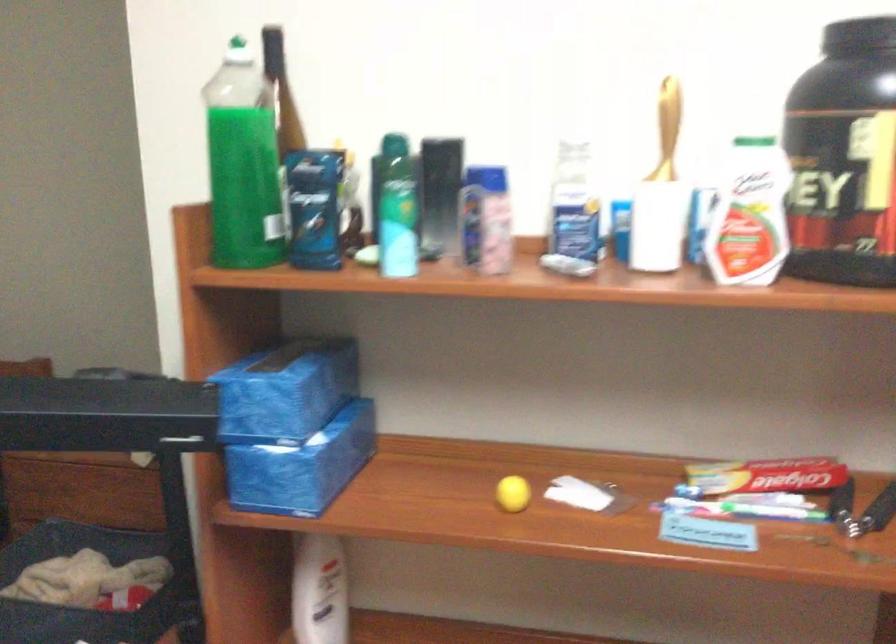
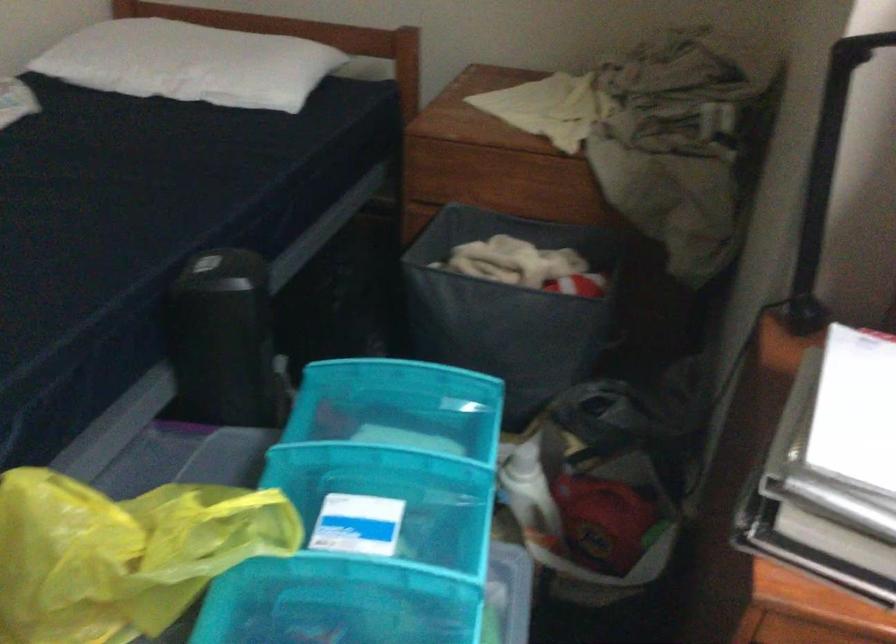
Question: Based on the continuous images, in which direction is the camera rotating? Reply with the corresponding letter.

Choices:
 (A) Left
 (B) Right
 (C) Up
 (D) Down

Answer: (D)